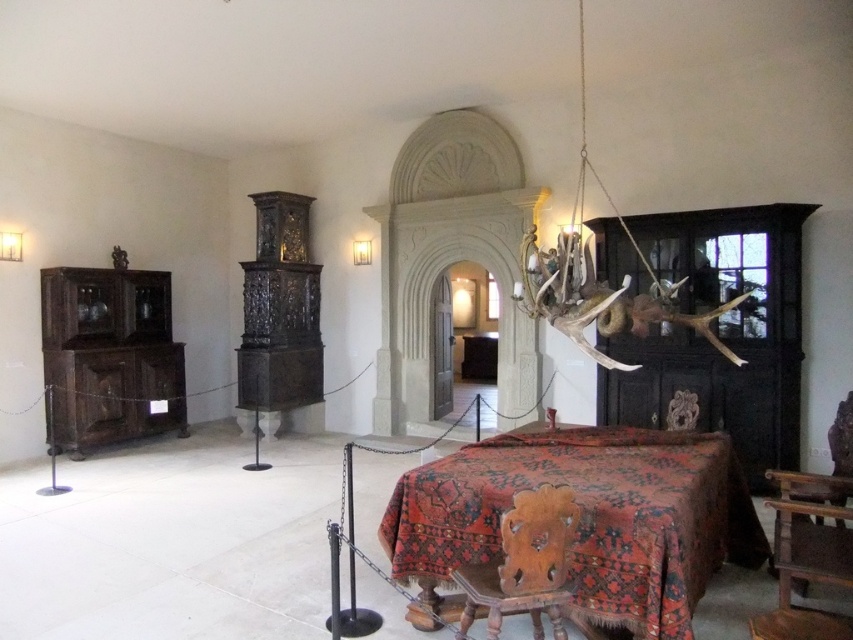
Can you confirm if dark brown wood cabinet at left is positioned to the right of wooden chair at lower right?

In fact, dark brown wood cabinet at left is to the left of wooden chair at lower right.

Describe the element at coordinates (109, 356) in the screenshot. This screenshot has height=640, width=853. I see `dark brown wood cabinet at left` at that location.

At what (x,y) coordinates should I click in order to perform the action: click on dark brown wood cabinet at left. Please return your answer as a coordinate pair (x, y). Image resolution: width=853 pixels, height=640 pixels. Looking at the image, I should click on (109, 356).

Who is higher up, carpeted wooden table at center or wooden chair at lower right?

Positioned higher is wooden chair at lower right.

Is carpeted wooden table at center to the right of wooden chair at lower right from the viewer's perspective?

In fact, carpeted wooden table at center is to the left of wooden chair at lower right.

Image resolution: width=853 pixels, height=640 pixels. I want to click on carpeted wooden table at center, so click(587, 516).

Is carpeted wooden table at center wider than dark brown wooden chair at right?

Correct, the width of carpeted wooden table at center exceeds that of dark brown wooden chair at right.

Between carpeted wooden table at center and dark brown wooden chair at right, which one appears on the right side from the viewer's perspective?

dark brown wooden chair at right

Locate an element on the screen. carpeted wooden table at center is located at coordinates (587, 516).